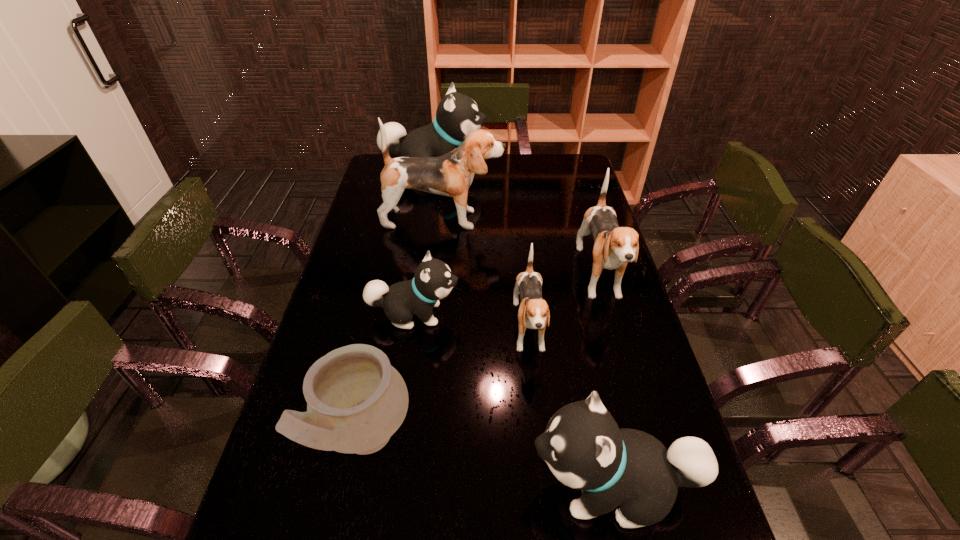
Identify the location of the leftmost brown puppy. The image size is (960, 540). (451, 175).

You are a GUI agent. You are given a task and a screenshot of the screen. Output one action in this format:
    pyautogui.click(x=<x>, y=<y>)
    Task: Click on the biggest brown puppy
    This screenshot has width=960, height=540.
    Given the screenshot: What is the action you would take?
    pyautogui.click(x=451, y=175)

Identify the location of the farthest object. This screenshot has width=960, height=540. (457, 115).

This screenshot has width=960, height=540. I want to click on the farthest puppy, so click(x=457, y=115).

Identify the location of the rightmost brown puppy. (x=614, y=246).

What are the coordinates of `the rightmost white puppy` in the screenshot? It's located at (584, 448).

This screenshot has height=540, width=960. I want to click on the second smallest white puppy, so click(x=584, y=448).

Locate an element on the screen. Image resolution: width=960 pixels, height=540 pixels. brown pottery is located at coordinates coord(356,400).

I want to click on the smallest brown puppy, so click(533, 313).

Find the location of a particular element. The width and height of the screenshot is (960, 540). the second nearest white puppy is located at coordinates (433, 280).